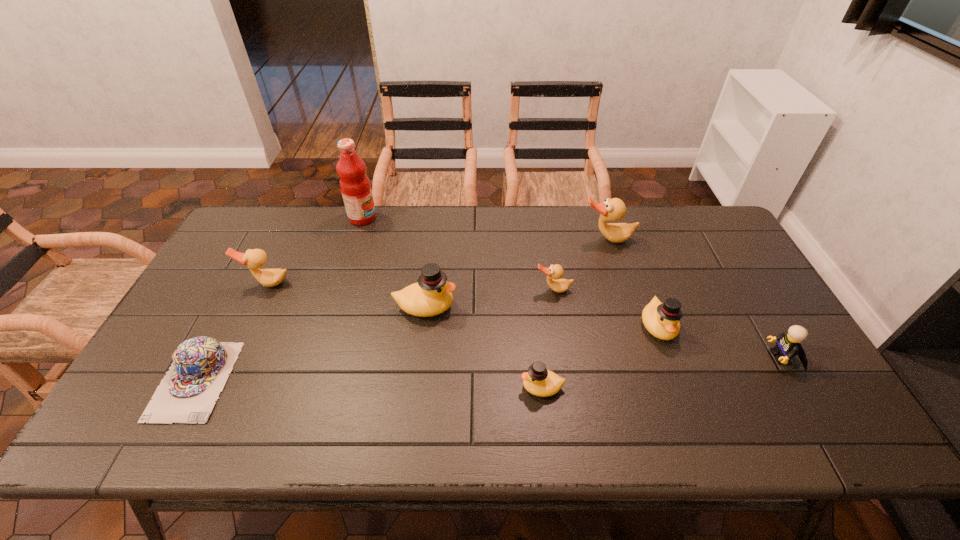
At what (x,y) coordinates should I click in order to perform the action: click on fruit juice. Please return your answer as a coordinate pair (x, y). Image resolution: width=960 pixels, height=540 pixels. Looking at the image, I should click on (355, 186).

Where is `the farthest object`? The image size is (960, 540). the farthest object is located at coordinates (355, 186).

Where is `the biggest tan duck`? This screenshot has height=540, width=960. the biggest tan duck is located at coordinates (614, 209).

Where is `the eighth nearest object`? Image resolution: width=960 pixels, height=540 pixels. the eighth nearest object is located at coordinates (614, 209).

Locate an element on the screen. the leftmost yellow duck is located at coordinates (432, 295).

Locate an element on the screen. This screenshot has width=960, height=540. the fourth object from left to right is located at coordinates (432, 295).

The width and height of the screenshot is (960, 540). I want to click on the leftmost tan duck, so click(254, 259).

Where is `the second biggest tan duck`? The image size is (960, 540). the second biggest tan duck is located at coordinates (254, 259).

At what (x,y) coordinates should I click in order to perform the action: click on the second smallest yellow duck. Please return your answer as a coordinate pair (x, y). The width and height of the screenshot is (960, 540). Looking at the image, I should click on (661, 319).

Find the location of a particular element. The height and width of the screenshot is (540, 960). the rightmost object is located at coordinates (788, 345).